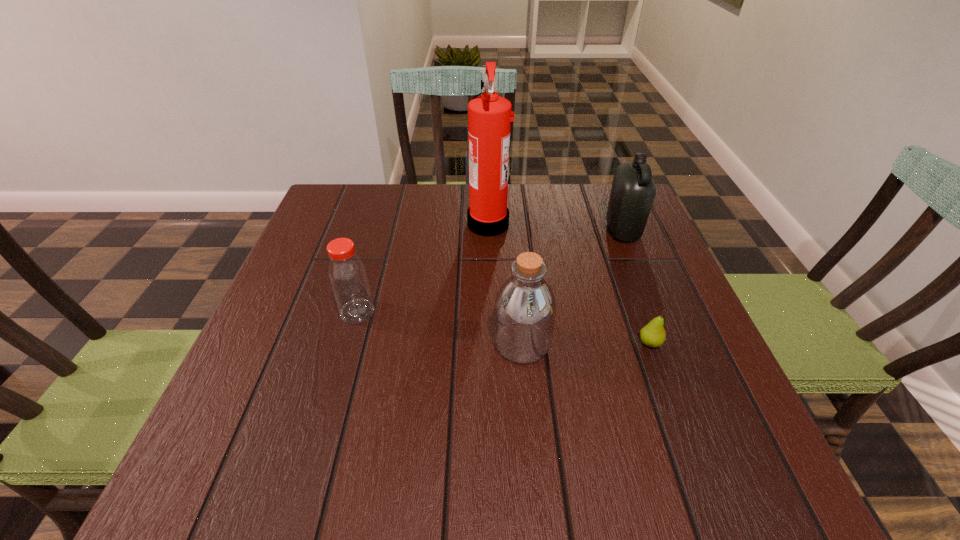
The height and width of the screenshot is (540, 960). In order to click on free spot located 0.220m on the front of the second bottle from right to left in this screenshot , I will do `click(535, 488)`.

You are a GUI agent. You are given a task and a screenshot of the screen. Output one action in this format:
    pyautogui.click(x=<x>, y=<y>)
    Task: Click on the free point located on the front of the second shortest object
    
    Given the screenshot: What is the action you would take?
    pyautogui.click(x=340, y=374)

The height and width of the screenshot is (540, 960). In order to click on blank space located 0.110m on the front of the shortest object in this screenshot , I will do `click(672, 403)`.

Where is `fire extinguisher present at the far edge`? fire extinguisher present at the far edge is located at coordinates (489, 116).

Where is `bottle that is at the far edge`? The image size is (960, 540). bottle that is at the far edge is located at coordinates (633, 191).

Locate an element on the screen. object at the left edge is located at coordinates (347, 274).

Where is `bottle at the right edge`? bottle at the right edge is located at coordinates 633,191.

At what (x,y) coordinates should I click in order to perform the action: click on pear that is at the right edge. Please return your answer as a coordinate pair (x, y). The height and width of the screenshot is (540, 960). Looking at the image, I should click on (653, 335).

Image resolution: width=960 pixels, height=540 pixels. Identify the location of object that is positioned at the far right corner. (633, 191).

In the image, there is a desktop. At what (x,y) coordinates should I click in order to perform the action: click on free space at the far edge. Please return your answer as a coordinate pair (x, y). Looking at the image, I should click on (565, 183).